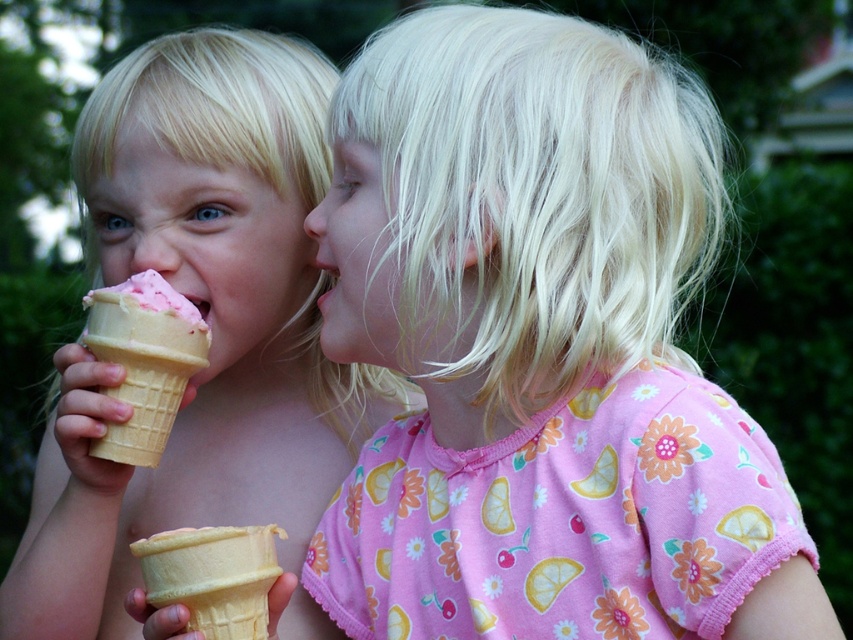
Question: Which point is closer to the camera?

Choices:
 (A) (165, 595)
 (B) (292, 333)
 (C) (62, 429)
 (D) (125, 384)

Answer: (A)

Question: Can you confirm if matte yellow ice cream cone at left is bigger than vanilla waffle cone at lower left?

Choices:
 (A) no
 (B) yes

Answer: (B)

Question: Is pink matte ice cream cone at left to the right of blonde hair at center from the viewer's perspective?

Choices:
 (A) no
 (B) yes

Answer: (A)

Question: Which object is farther from the camera taking this photo?

Choices:
 (A) pink soft serve ice cream at left
 (B) blonde hair at center

Answer: (A)

Question: Which object is the closest to the pink soft serve ice cream at left?

Choices:
 (A) blonde hair at center
 (B) pink matte ice cream cone at left
 (C) vanilla waffle cone at lower left

Answer: (B)

Question: Can you confirm if matte yellow ice cream cone at left is thinner than vanilla waffle cone at lower left?

Choices:
 (A) yes
 (B) no

Answer: (B)